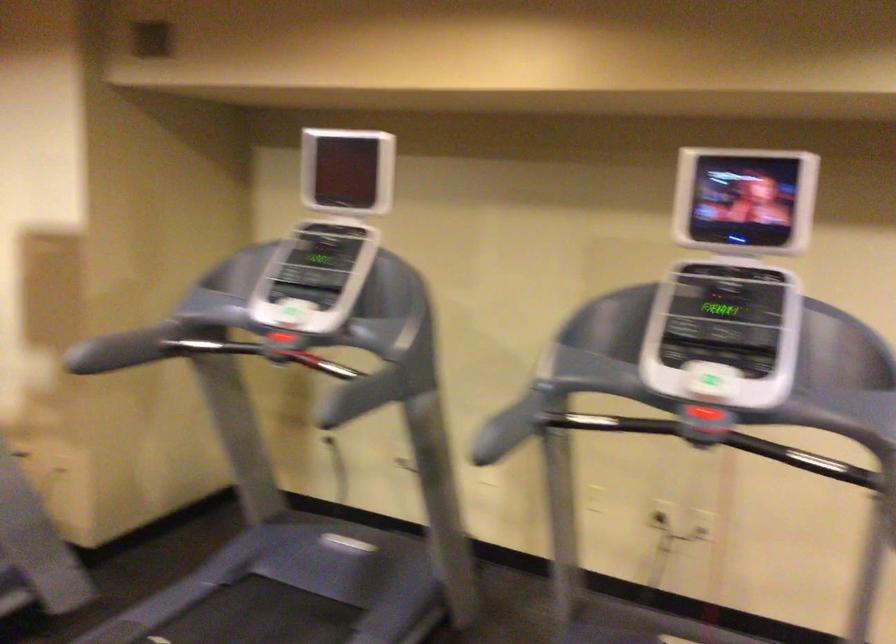
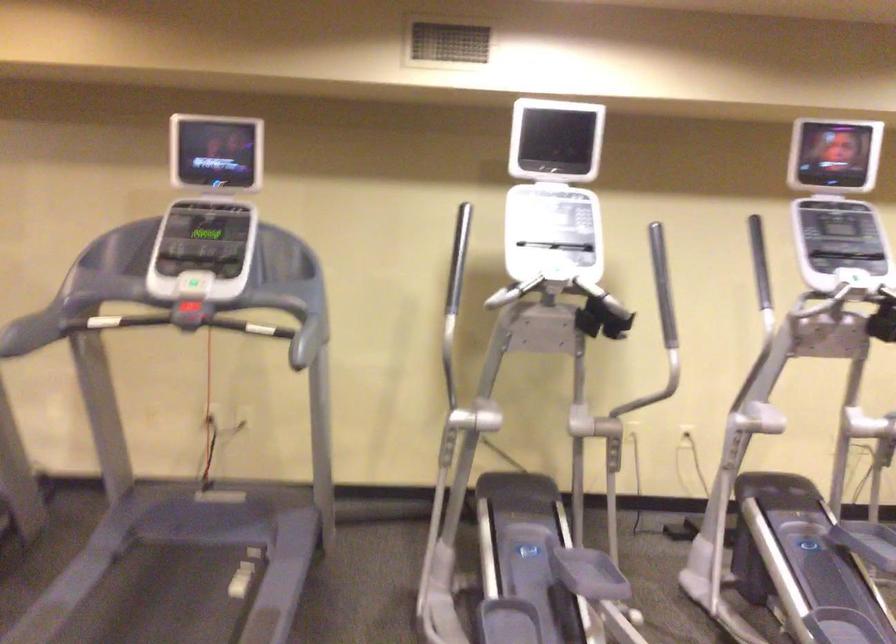
In the second image, find the point that corresponds to point (704, 438) in the first image.

(187, 321)